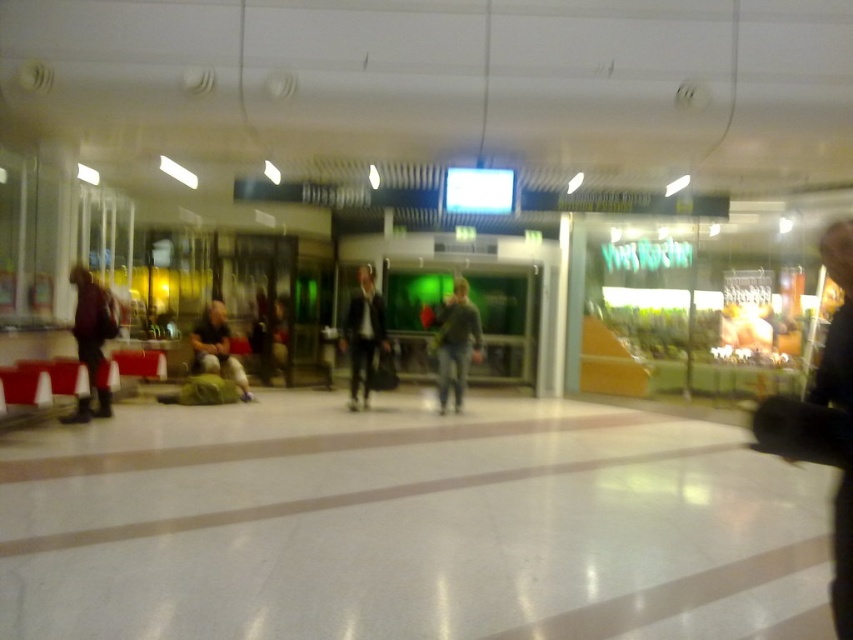
Question: Which object is the closest to the black leather jacket at right?

Choices:
 (A) matte black jacket at left
 (B) dark blue suit at center
 (C) dark gray sweater at center

Answer: (A)

Question: Estimate the real-world distances between objects in this image. Which object is farther from the dark blue suit at center?

Choices:
 (A) black leather jacket at right
 (B) green fabric bag at center

Answer: (A)

Question: Can you confirm if dark gray sweater at center is smaller than dark blue suit at center?

Choices:
 (A) yes
 (B) no

Answer: (B)

Question: Can you confirm if black leather jacket at right is wider than green fabric bag at center?

Choices:
 (A) no
 (B) yes

Answer: (A)

Question: Which point appears closest to the camera in this image?

Choices:
 (A) (90, 385)
 (B) (849, 257)
 (C) (221, 348)

Answer: (B)

Question: Does black leather jacket at right have a larger size compared to dark blue suit at center?

Choices:
 (A) no
 (B) yes

Answer: (A)